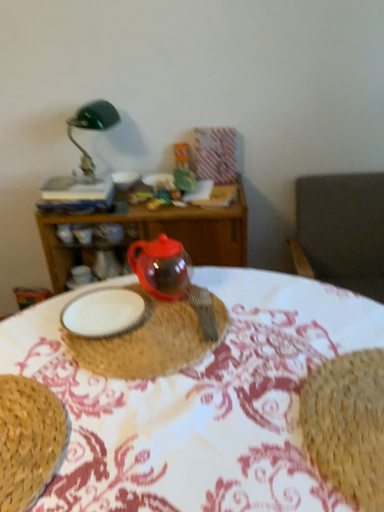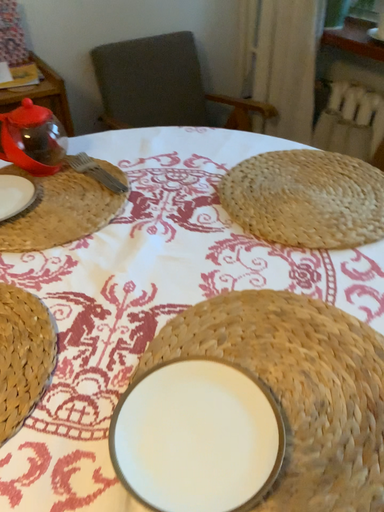
Question: How did the camera likely rotate when shooting the video?

Choices:
 (A) rotated right
 (B) rotated left

Answer: (A)